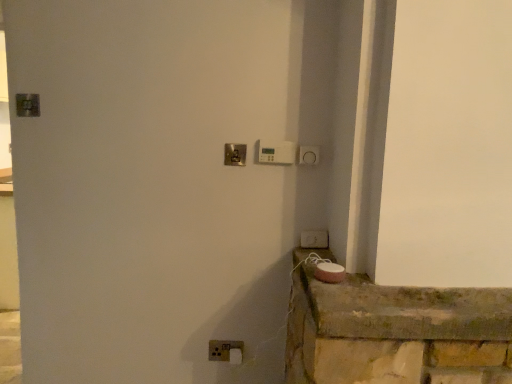
Question: Does white plastic light switch at lower center, placed as the 3th light switch when sorted from right to left, have a greater width compared to white plastic light switch at lower right, placed as the 1th light switch when sorted from right to left?

Choices:
 (A) no
 (B) yes

Answer: (A)

Question: From a real-world perspective, is white plastic light switch at lower center, placed as the 3th light switch when sorted from right to left, on top of white plastic light switch at lower right, which appears as the 2th light switch when viewed from the top?

Choices:
 (A) yes
 (B) no

Answer: (B)

Question: From the image's perspective, does white plastic light switch at lower center, placed as the first light switch when sorted from bottom to top, appear lower than white plastic light switch at lower right, placed as the 1th light switch when sorted from right to left?

Choices:
 (A) no
 (B) yes

Answer: (B)

Question: Is white plastic light switch at lower center, placed as the first light switch when sorted from bottom to top, to the left of white plastic light switch at lower right, acting as the 2th light switch starting from the bottom, from the viewer's perspective?

Choices:
 (A) no
 (B) yes

Answer: (B)

Question: Considering the relative sizes of white plastic light switch at lower center, the 1th light switch positioned from the left, and white plastic light switch at lower right, placed as the 1th light switch when sorted from right to left, in the image provided, is white plastic light switch at lower center, the 1th light switch positioned from the left, smaller than white plastic light switch at lower right, placed as the 1th light switch when sorted from right to left,?

Choices:
 (A) yes
 (B) no

Answer: (A)

Question: Considering the positions of point (312, 248) and point (271, 142), is point (312, 248) closer or farther from the camera than point (271, 142)?

Choices:
 (A) closer
 (B) farther

Answer: (A)

Question: Visually, is white plastic light switch at lower right, which appears as the 2th light switch when viewed from the top, positioned to the left or to the right of white plastic thermostat at upper center, which is the 3th light switch in bottom-to-top order?

Choices:
 (A) left
 (B) right

Answer: (B)

Question: From the image's perspective, is white plastic light switch at lower right, placed as the 1th light switch when sorted from right to left, located above or below white plastic thermostat at upper center, which is counted as the first light switch, starting from the top?

Choices:
 (A) above
 (B) below

Answer: (B)

Question: Is white plastic light switch at lower right, acting as the 2th light switch starting from the bottom, inside or outside of white plastic thermostat at upper center, which is the 3th light switch in bottom-to-top order?

Choices:
 (A) inside
 (B) outside

Answer: (B)

Question: Does point (374, 364) appear closer or farther from the camera than point (262, 140)?

Choices:
 (A) closer
 (B) farther

Answer: (A)

Question: In terms of height, does pink matte speaker at lower right look taller or shorter compared to white plastic thermostat at upper center, which is counted as the first light switch, starting from the top?

Choices:
 (A) tall
 (B) short

Answer: (A)

Question: Is pink matte speaker at lower right in front of or behind white plastic thermostat at upper center, which ranks as the second light switch in right-to-left order, in the image?

Choices:
 (A) behind
 (B) front

Answer: (B)

Question: Is pink matte speaker at lower right to the left or to the right of white plastic thermostat at upper center, which is the 3th light switch in bottom-to-top order, in the image?

Choices:
 (A) right
 (B) left

Answer: (A)

Question: Considering the relative positions of white plastic light switch at lower center, placed as the 3th light switch when sorted from right to left, and white plastic light switch at lower right, which appears as the 3th light switch when viewed from the left, in the image provided, is white plastic light switch at lower center, placed as the 3th light switch when sorted from right to left, to the left or to the right of white plastic light switch at lower right, which appears as the 3th light switch when viewed from the left,?

Choices:
 (A) left
 (B) right

Answer: (A)

Question: Is point (210, 342) positioned closer to the camera than point (306, 240)?

Choices:
 (A) farther
 (B) closer

Answer: (A)